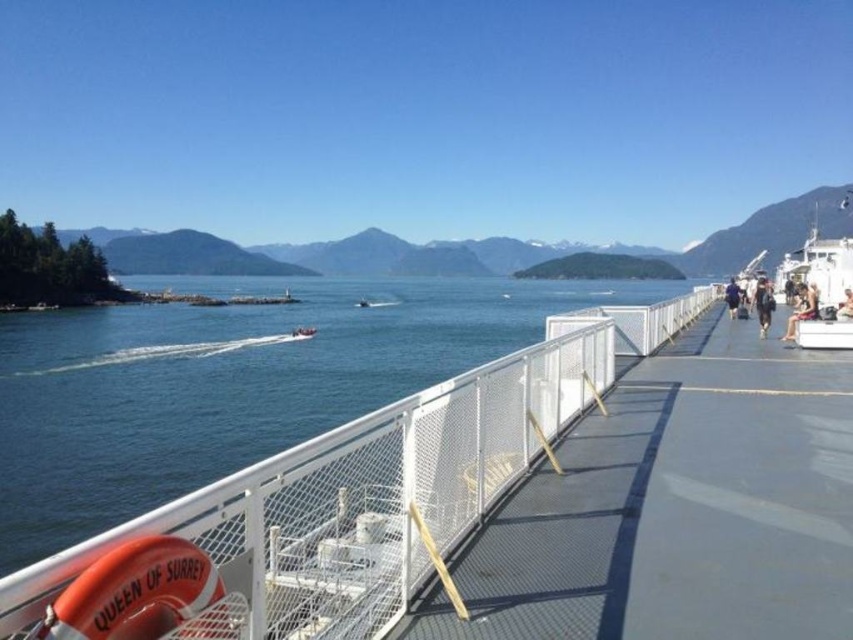
Question: Does white mesh fence at center have a lesser width compared to light brown leather jacket at right?

Choices:
 (A) no
 (B) yes

Answer: (B)

Question: Can you confirm if light brown leather jacket at upper right is thinner than white plastic boat at center?

Choices:
 (A) yes
 (B) no

Answer: (B)

Question: Which point is farther from the camera taking this photo?

Choices:
 (A) (845, 296)
 (B) (727, 282)

Answer: (B)

Question: Is white mesh fence at center positioned before purple fabric bag at center-right?

Choices:
 (A) no
 (B) yes

Answer: (B)

Question: Which object is farther from the camera taking this photo?

Choices:
 (A) black fabric pants at right
 (B) purple fabric bag at center-right
 (C) light brown leather jacket at right

Answer: (B)

Question: Which point is farther to the camera?

Choices:
 (A) black fabric pants at right
 (B) white plastic boat at center

Answer: (B)